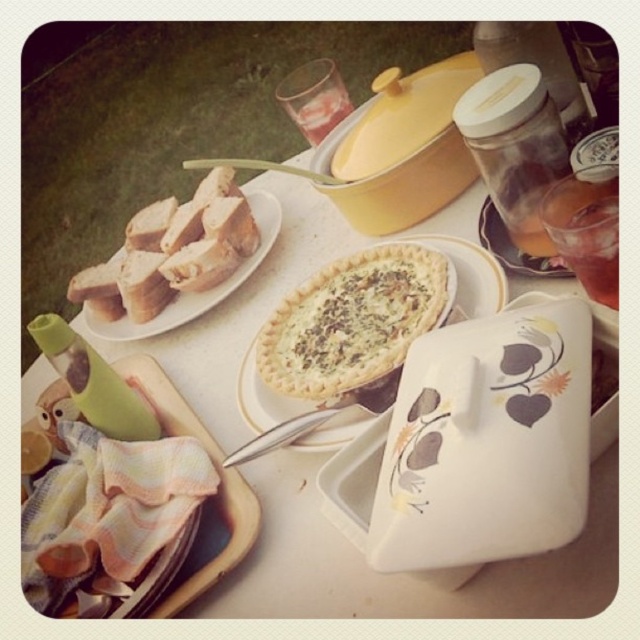
You are setting up a picnic and have a white ceramic tray at lower left and a translucent glass at upper right. Which one can you place more snacks on without spilling?

The white ceramic tray at lower left has a larger width than the translucent glass at upper right, so it can hold more snacks without spilling.

You are setting up a picnic table and need to stack dishes. The white ceramic tray at lower left and the white ceramic plate at upper left are both available. Which one can you stack more items on top of?

The white ceramic plate at upper left is thicker than the white ceramic tray at lower left, so it can support more items stacked on top.